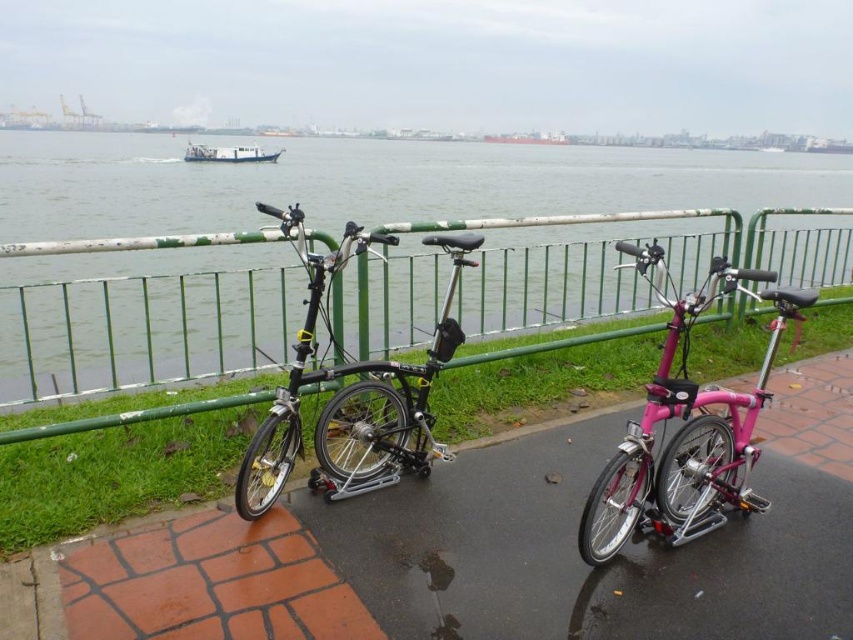
Who is shorter, pink matte bicycle at center or white matte boat at upper center?

white matte boat at upper center is shorter.

Is pink matte bicycle at center wider than white matte boat at upper center?

Incorrect, pink matte bicycle at center's width does not surpass white matte boat at upper center's.

Which is in front, point (689, 465) or point (256, 160)?

Point (689, 465)

At what (x,y) coordinates should I click in order to perform the action: click on pink matte bicycle at center. Please return your answer as a coordinate pair (x, y). Image resolution: width=853 pixels, height=640 pixels. Looking at the image, I should click on (688, 435).

Does green metal fence at center have a greater width compared to black matte folding bike at center?

Incorrect, green metal fence at center's width does not surpass black matte folding bike at center's.

Locate an element on the screen. The width and height of the screenshot is (853, 640). green metal fence at center is located at coordinates (142, 330).

Identify the location of green metal fence at center. This screenshot has height=640, width=853. (142, 330).

Does point (445, 627) come in front of point (634, 506)?

Yes, it is in front of point (634, 506).

Can you confirm if black rubber bicycle at center is smaller than pink matte bicycle at center?

Actually, black rubber bicycle at center might be larger than pink matte bicycle at center.

You are a GUI agent. You are given a task and a screenshot of the screen. Output one action in this format:
    pyautogui.click(x=<x>, y=<y>)
    Task: Click on the black rubber bicycle at center
    
    Given the screenshot: What is the action you would take?
    pyautogui.click(x=624, y=550)